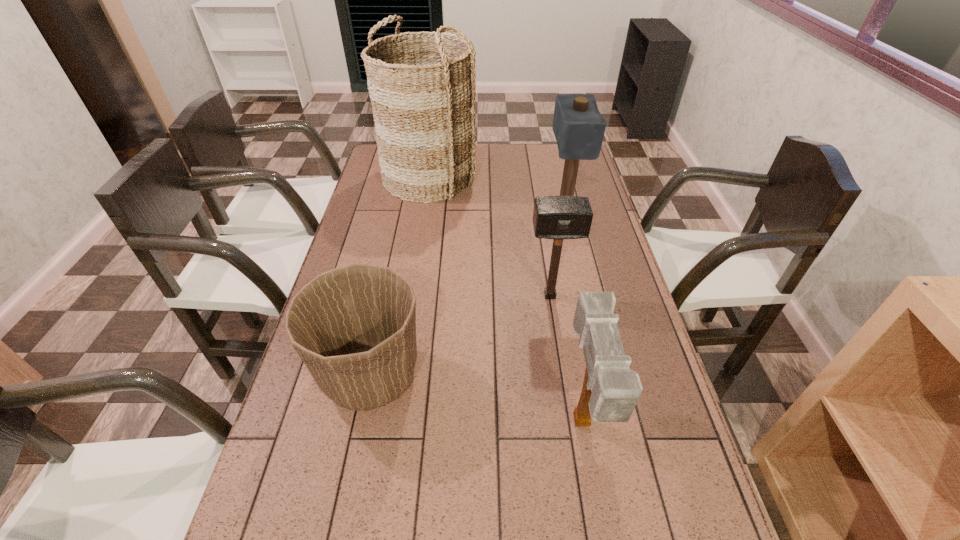
What are the coordinates of `basket` in the screenshot? It's located at (422, 86).

Where is `the second tallest object`? Image resolution: width=960 pixels, height=540 pixels. the second tallest object is located at coordinates (578, 126).

In order to click on the farthest mallet in this screenshot , I will do `click(578, 126)`.

I want to click on the second nearest mallet, so click(x=554, y=217).

The image size is (960, 540). I want to click on the nearest mallet, so click(x=610, y=392).

Where is `the shortest object`? The image size is (960, 540). the shortest object is located at coordinates (354, 327).

The height and width of the screenshot is (540, 960). I want to click on vacant space located on the front of the tallest object, so click(418, 256).

Locate an element on the screen. The image size is (960, 540). vacant space located on the left of the fourth shortest object is located at coordinates (529, 206).

The width and height of the screenshot is (960, 540). Find the location of `vacant space positioned on the back of the third farthest object`. vacant space positioned on the back of the third farthest object is located at coordinates (545, 264).

The image size is (960, 540). I want to click on vacant region located on the back of the nearest mallet, so click(x=564, y=329).